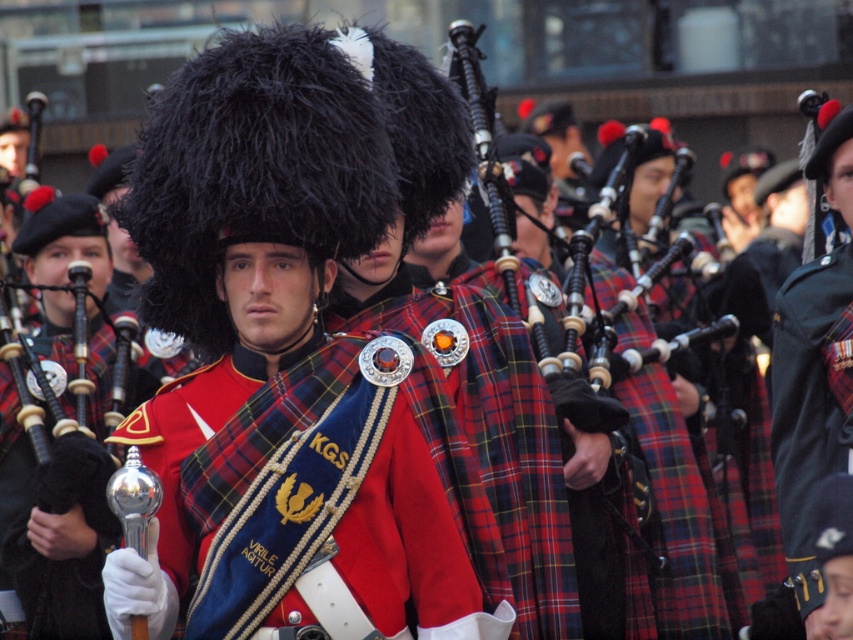
Who is shorter, red plaid sash at center or wooden bagpipe at center?

With less height is red plaid sash at center.

Is red plaid sash at center below wooden bagpipe at center?

Correct, red plaid sash at center is located below wooden bagpipe at center.

The width and height of the screenshot is (853, 640). Describe the element at coordinates (293, 508) in the screenshot. I see `red plaid sash at center` at that location.

The height and width of the screenshot is (640, 853). What are the coordinates of `red plaid sash at center` in the screenshot? It's located at (293, 508).

Does red plaid sash at center have a smaller size compared to green fabric uniform at center?

Result: Yes, red plaid sash at center is smaller than green fabric uniform at center.

Who is positioned more to the right, red plaid sash at center or green fabric uniform at center?

Positioned to the right is green fabric uniform at center.

Does point (247, 371) come closer to viewer compared to point (811, 296)?

Yes, point (247, 371) is in front of point (811, 296).

Where is `red plaid sash at center`? red plaid sash at center is located at coordinates (293, 508).

Which of these two, green fabric uniform at center or wooden bagpipe at center, stands taller?

Standing taller between the two is wooden bagpipe at center.

Which is more to the left, green fabric uniform at center or wooden bagpipe at center?

Positioned to the left is wooden bagpipe at center.

Is point (801, 561) closer to camera compared to point (624, 604)?

Yes, point (801, 561) is in front of point (624, 604).

At what (x,y) coordinates should I click in order to perform the action: click on green fabric uniform at center. Please return your answer as a coordinate pair (x, y). Looking at the image, I should click on (814, 369).